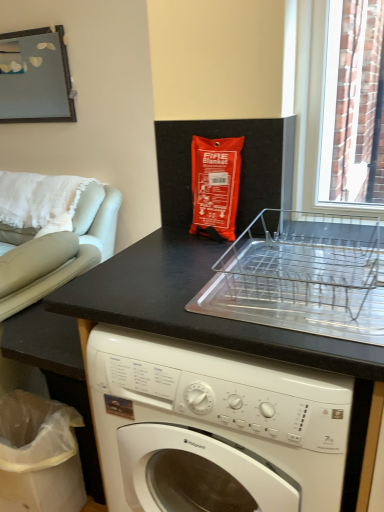
Measure the distance between point (343, 330) and camera.

Point (343, 330) is 31.93 inches away from camera.

This screenshot has width=384, height=512. Identify the location of white plastic bag at lower left. (39, 455).

Where is `white cotton pillow at left`? This screenshot has height=512, width=384. white cotton pillow at left is located at coordinates (37, 199).

Image resolution: width=384 pixels, height=512 pixels. Describe the element at coordinates (57, 249) in the screenshot. I see `light gray leather armchair at left` at that location.

This screenshot has height=512, width=384. I want to click on clear plastic dish rack at center, so tap(302, 276).

In the scene shown: Which of these two, white cotton pillow at left or clear plastic dish rack at center, is smaller?

Smaller between the two is clear plastic dish rack at center.

Does white cotton pillow at left appear on the left side of clear plastic dish rack at center?

Indeed, white cotton pillow at left is positioned on the left side of clear plastic dish rack at center.

From a real-world perspective, is white cotton pillow at left located higher than clear plastic dish rack at center?

Incorrect, from a real-world perspective, white cotton pillow at left is lower than clear plastic dish rack at center.

Which of these two, light gray leather armchair at left or white cotton pillow at left, stands shorter?

With less height is white cotton pillow at left.

Considering the sizes of objects light gray leather armchair at left and white cotton pillow at left in the image provided, who is bigger, light gray leather armchair at left or white cotton pillow at left?

light gray leather armchair at left.

Measure the distance between light gray leather armchair at left and white cotton pillow at left.

light gray leather armchair at left is 7.38 inches from white cotton pillow at left.

Looking at their sizes, would you say light gray leather armchair at left is wider or thinner than white cotton pillow at left?

In the image, light gray leather armchair at left appears to be wider than white cotton pillow at left.

Is metallic mirror at upper left not near light gray leather armchair at left?

No, metallic mirror at upper left is in close proximity to light gray leather armchair at left.

Between metallic mirror at upper left and light gray leather armchair at left, which one has larger width?

light gray leather armchair at left is wider.

Looking at this image, is metallic mirror at upper left positioned behind light gray leather armchair at left?

Yes, the depth of metallic mirror at upper left is greater than that of light gray leather armchair at left.

Is metallic mirror at upper left inside or outside of light gray leather armchair at left?

metallic mirror at upper left is not enclosed by light gray leather armchair at left.

Does white cotton pillow at left touch metallic mirror at upper left?

white cotton pillow at left and metallic mirror at upper left are not in contact.

Considering the sizes of objects white cotton pillow at left and metallic mirror at upper left in the image provided, who is wider, white cotton pillow at left or metallic mirror at upper left?

With larger width is white cotton pillow at left.

From the image's perspective, is white cotton pillow at left on metallic mirror at upper left?

Actually, white cotton pillow at left appears below metallic mirror at upper left in the image.

Which of these two, white cotton pillow at left or metallic mirror at upper left, is bigger?

Bigger between the two is white cotton pillow at left.

Would you say metallic mirror at upper left is a long distance from white cotton pillow at left?

No, metallic mirror at upper left is not far away from white cotton pillow at left.

How distant is metallic mirror at upper left from white cotton pillow at left?

They are 29.15 inches apart.

From a real-world perspective, is metallic mirror at upper left positioned above or below white cotton pillow at left?

metallic mirror at upper left is situated higher than white cotton pillow at left in the real world.

Can you confirm if metallic mirror at upper left is bigger than white cotton pillow at left?

Actually, metallic mirror at upper left might be smaller than white cotton pillow at left.

The width and height of the screenshot is (384, 512). In order to click on appliance that is above the light gray leather armchair at left (from a real-world perspective) in this screenshot , I will do `click(302, 276)`.

From a real-world perspective, relative to light gray leather armchair at left, is clear plastic dish rack at center vertically above or below?

Clearly, from a real-world perspective, clear plastic dish rack at center is above light gray leather armchair at left.

From the image's perspective, who appears lower, clear plastic dish rack at center or light gray leather armchair at left?

clear plastic dish rack at center.

Is point (361, 300) positioned after point (27, 230)?

No.

In the image, there is a clear plastic dish rack at center. Where is `pillow below it (from a real-world perspective)`? The width and height of the screenshot is (384, 512). pillow below it (from a real-world perspective) is located at coordinates (37, 199).

Is clear plastic dish rack at center surrounding white cotton pillow at left?

Actually, white cotton pillow at left is outside clear plastic dish rack at center.

Measure the distance from clear plastic dish rack at center to white cotton pillow at left.

The distance of clear plastic dish rack at center from white cotton pillow at left is 2.43 meters.

Considering the sizes of objects clear plastic dish rack at center and white cotton pillow at left in the image provided, who is wider, clear plastic dish rack at center or white cotton pillow at left?

With larger width is white cotton pillow at left.

You are a GUI agent. You are given a task and a screenshot of the screen. Output one action in this format:
    pyautogui.click(x=<x>, y=<y>)
    Task: Click on the appliance in front of the white cotton pillow at left
    The height and width of the screenshot is (512, 384).
    Given the screenshot: What is the action you would take?
    pyautogui.click(x=302, y=276)

Where is `pillow behind the light gray leather armchair at left`? Image resolution: width=384 pixels, height=512 pixels. pillow behind the light gray leather armchair at left is located at coordinates (37, 199).

Looking at the image, which one is located closer to light gray leather armchair at left, white plastic bag at lower left or metallic mirror at upper left?

metallic mirror at upper left is closer to light gray leather armchair at left.

Considering their positions, is light gray leather armchair at left positioned closer to metallic mirror at upper left than white cotton pillow at left?

white cotton pillow at left.

Which object lies further to the anchor point white cotton pillow at left, metallic mirror at upper left or clear plastic dish rack at center?

clear plastic dish rack at center.

Based on their spatial positions, is black matte counter at lower left or white cotton pillow at left closer to metallic mirror at upper left?

white cotton pillow at left is closer to metallic mirror at upper left.

When comparing their distances from white plastic bag at lower left, does clear plastic dish rack at center or black matte counter at lower left seem further?

clear plastic dish rack at center.

From the image, which object appears to be farther from white cotton pillow at left, white plastic bag at lower left or black matte counter at lower left?

black matte counter at lower left is further to white cotton pillow at left.

Which object lies further to the anchor point light gray leather armchair at left, metallic mirror at upper left or black matte counter at lower left?

The object further to light gray leather armchair at left is black matte counter at lower left.

Considering their positions, is white cotton pillow at left positioned further to light gray leather armchair at left than metallic mirror at upper left?

metallic mirror at upper left is positioned further to the anchor light gray leather armchair at left.

Locate an element on the screen. The height and width of the screenshot is (512, 384). garbage between black matte counter at lower left and metallic mirror at upper left along the z-axis is located at coordinates (39, 455).

At what (x,y) coordinates should I click in order to perform the action: click on garbage positioned between black matte counter at lower left and light gray leather armchair at left from near to far. Please return your answer as a coordinate pair (x, y). Looking at the image, I should click on (39, 455).

The height and width of the screenshot is (512, 384). What are the coordinates of `pillow between metallic mirror at upper left and light gray leather armchair at left vertically` in the screenshot? It's located at (37, 199).

Find the location of `armchair between white plastic bag at lower left and white cotton pillow at left in the front-back direction`. armchair between white plastic bag at lower left and white cotton pillow at left in the front-back direction is located at coordinates pos(57,249).